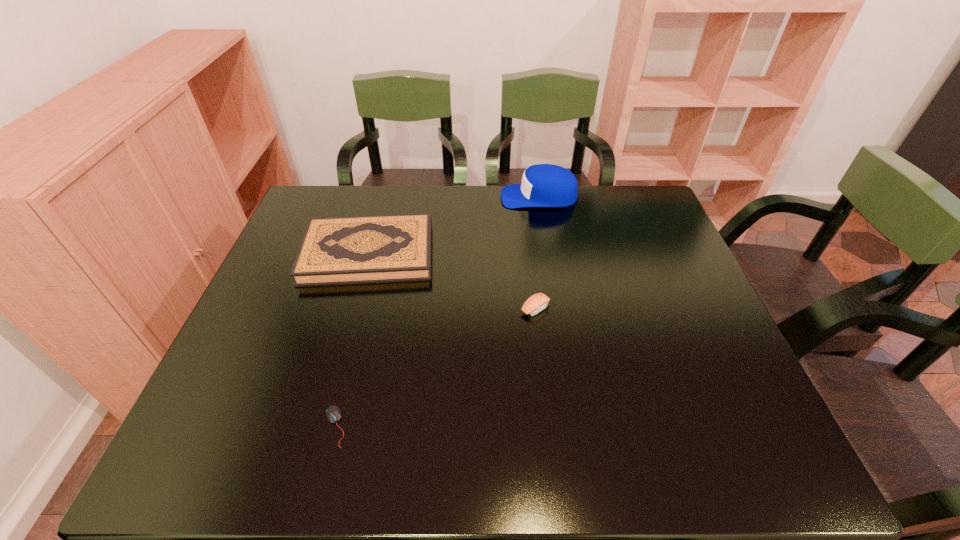
Where is `free space at the near edge`? Image resolution: width=960 pixels, height=540 pixels. free space at the near edge is located at coordinates (307, 444).

You are a GUI agent. You are given a task and a screenshot of the screen. Output one action in this format:
    pyautogui.click(x=<x>, y=<y>)
    Task: Click on the free point at the left edge
    
    Given the screenshot: What is the action you would take?
    pyautogui.click(x=202, y=411)

The width and height of the screenshot is (960, 540). Find the location of `free region at the right edge`. free region at the right edge is located at coordinates (645, 241).

Image resolution: width=960 pixels, height=540 pixels. In the image, there is a desktop. Find the location of `free space at the far left corner`. free space at the far left corner is located at coordinates tap(327, 208).

At what (x,y) coordinates should I click in order to perform the action: click on free spot between the third shortest object and the shortest object. Please return your answer as a coordinate pair (x, y). Image resolution: width=960 pixels, height=540 pixels. Looking at the image, I should click on (351, 340).

Locate an element on the screen. This screenshot has height=540, width=960. vacant space in between the sushi and the tallest object is located at coordinates (538, 252).

Identify the location of free point between the third farthest object and the farthest object. (538, 252).

Where is `vacant area that lies between the mouse and the second farthest object`? vacant area that lies between the mouse and the second farthest object is located at coordinates (351, 340).

Locate an element on the screen. This screenshot has width=960, height=540. empty location between the third nearest object and the third farthest object is located at coordinates (452, 280).

Locate an element on the screen. This screenshot has width=960, height=540. free space between the second farthest object and the third tallest object is located at coordinates (452, 280).